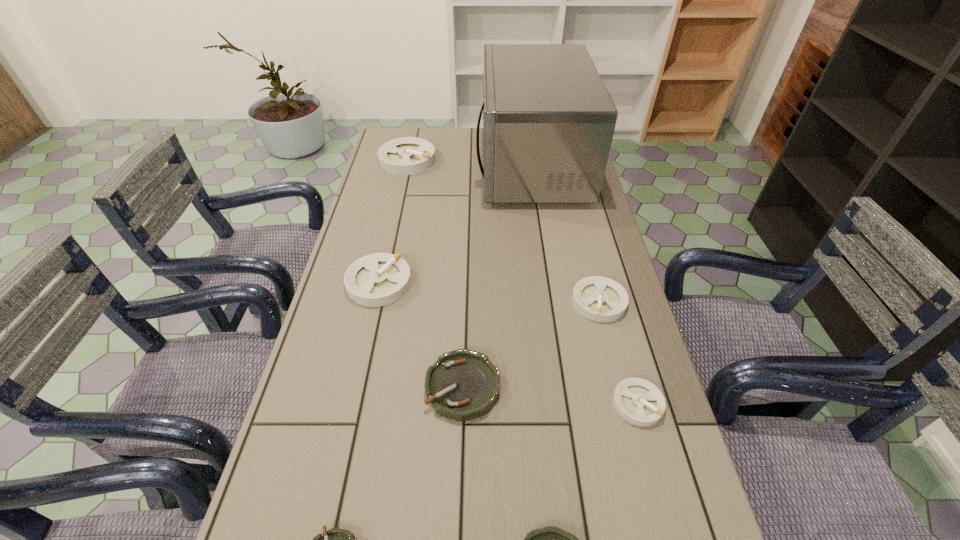
Identify the location of vacant space located on the front-facing side of the tallest object. (387, 164).

This screenshot has width=960, height=540. In order to click on free point located on the front-facing side of the tallest object in this screenshot , I will do `click(445, 164)`.

What are the coordinates of `free spot located on the front-facing side of the tallest object` in the screenshot? It's located at (403, 164).

This screenshot has width=960, height=540. Find the location of `vacant space located 0.240m on the right of the farthest ashtray`. vacant space located 0.240m on the right of the farthest ashtray is located at coordinates coord(498,160).

I want to click on vacant space located on the right of the third smallest gray ashtray, so click(444, 283).

I want to click on free region located on the left of the fourth tallest object, so click(430, 302).

You are a GUI agent. You are given a task and a screenshot of the screen. Output one action in this format:
    pyautogui.click(x=<x>, y=<y>)
    Task: Click on the vacant space situated 0.220m on the left of the fourth ashtray from right to left
    
    Given the screenshot: What is the action you would take?
    pyautogui.click(x=328, y=387)

Identify the location of free space located on the back of the smallest gray ashtray. Image resolution: width=960 pixels, height=540 pixels. (612, 312).

Locate an element on the screen. microwave oven at the far edge is located at coordinates (548, 120).

Where is `ashtray present at the far edge`? Image resolution: width=960 pixels, height=540 pixels. ashtray present at the far edge is located at coordinates (409, 155).